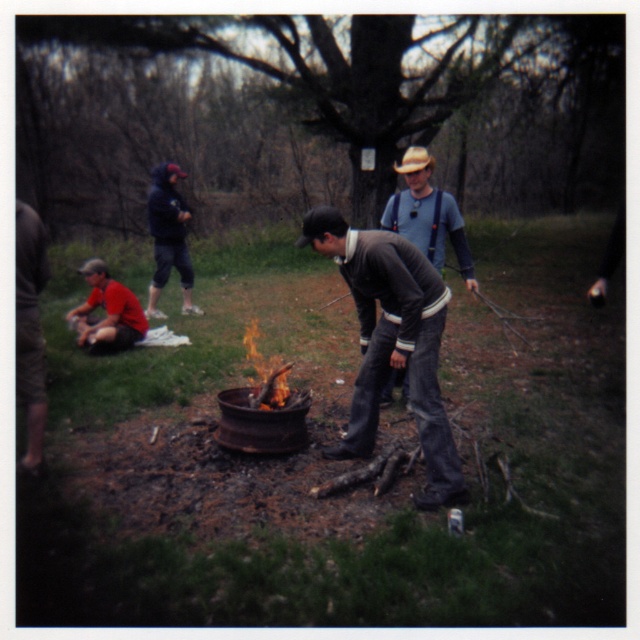
Is point (365, 406) less distant than point (420, 205)?

Yes, point (365, 406) is in front of point (420, 205).

Does dark gray jeans at center have a lesser width compared to matte blue shirt at center?

No, dark gray jeans at center is not thinner than matte blue shirt at center.

Who is more distant from viewer, (426, 465) or (440, 260)?

The point (440, 260) is more distant.

The width and height of the screenshot is (640, 640). I want to click on dark gray jeans at center, so click(392, 340).

Between matte blue shirt at center and dark blue hoodie at upper left, which one is positioned lower?

matte blue shirt at center

Between point (461, 275) and point (182, 310), which one is positioned in front?

Positioned in front is point (461, 275).

Who is more distant from viewer, [396,209] or [184,260]?

Point [184,260]

Locate an element on the screen. matte blue shirt at center is located at coordinates (428, 214).

Does dark gray jeans at center appear on the left side of dark blue hoodie at upper left?

Incorrect, dark gray jeans at center is not on the left side of dark blue hoodie at upper left.

Can you confirm if dark gray jeans at center is thinner than dark blue hoodie at upper left?

No, dark gray jeans at center is not thinner than dark blue hoodie at upper left.

The width and height of the screenshot is (640, 640). Describe the element at coordinates (392, 340) in the screenshot. I see `dark gray jeans at center` at that location.

Locate an element on the screen. This screenshot has width=640, height=640. dark gray jeans at center is located at coordinates (392, 340).